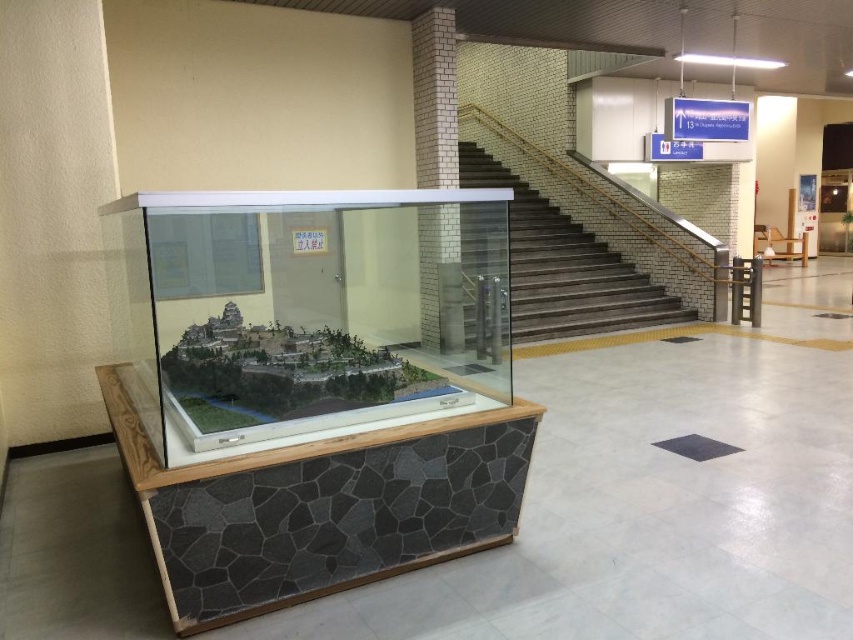
Question: Which object appears closest to the camera in this image?

Choices:
 (A) dark brown wooden stairs at upper right
 (B) clear acrylic display case at center

Answer: (B)

Question: Which object is closer to the camera taking this photo?

Choices:
 (A) dark brown wooden stairs at upper right
 (B) clear acrylic display case at center

Answer: (B)

Question: Does clear acrylic display case at center appear on the left side of dark brown wooden stairs at upper right?

Choices:
 (A) yes
 (B) no

Answer: (A)

Question: In this image, where is clear acrylic display case at center located relative to dark brown wooden stairs at upper right?

Choices:
 (A) above
 (B) below

Answer: (B)

Question: Can you confirm if clear acrylic display case at center is smaller than dark brown wooden stairs at upper right?

Choices:
 (A) yes
 (B) no

Answer: (A)